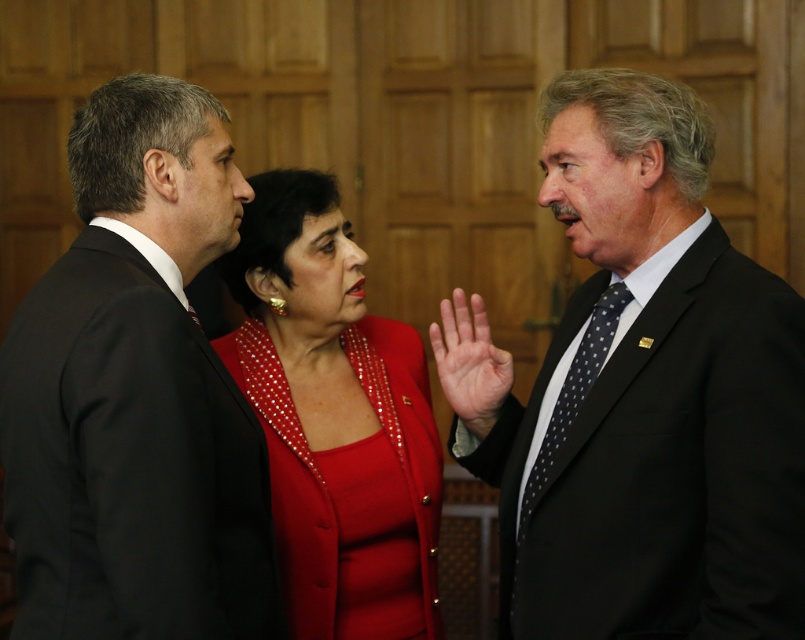
What do you see at coordinates (642, 394) in the screenshot? I see `black suit at right` at bounding box center [642, 394].

Who is shorter, black suit at right or black dotted tie at right?

Standing shorter between the two is black dotted tie at right.

This screenshot has width=805, height=640. I want to click on black suit at right, so click(642, 394).

What do you see at coordinates (642, 394) in the screenshot?
I see `black suit at right` at bounding box center [642, 394].

Which is below, black suit at right or black suit at left?

Positioned lower is black suit at right.

What do you see at coordinates (642, 394) in the screenshot? I see `black suit at right` at bounding box center [642, 394].

Locate an element on the screen. black suit at right is located at coordinates (642, 394).

In the scene shown: Between black suit at left and black dotted tie at right, which one has less height?

With less height is black dotted tie at right.

What do you see at coordinates (135, 396) in the screenshot?
I see `black suit at left` at bounding box center [135, 396].

Which is in front, point (42, 285) or point (535, 464)?

Point (42, 285)

Identify the location of black suit at left. Image resolution: width=805 pixels, height=640 pixels. (135, 396).